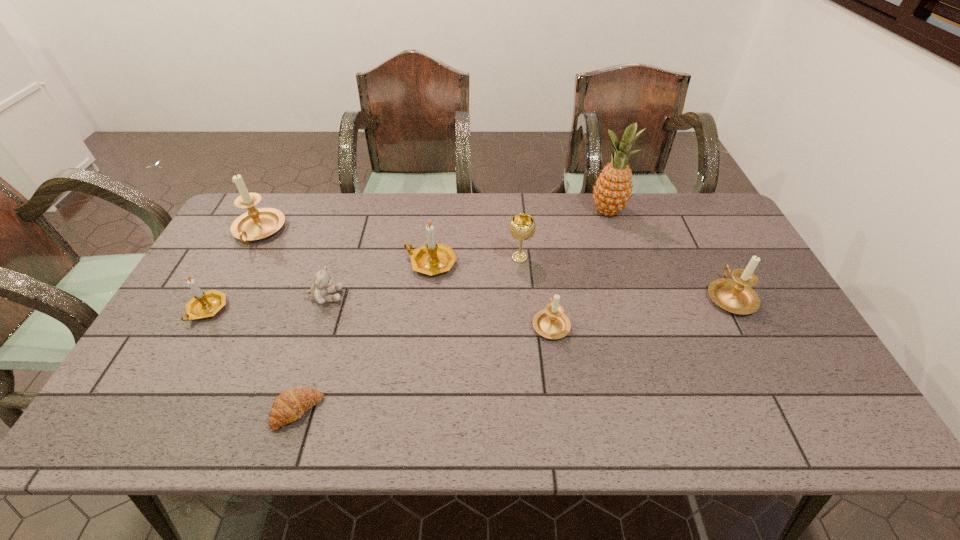
The height and width of the screenshot is (540, 960). In order to click on vacant space at the far right corner in this screenshot , I will do `click(693, 200)`.

Where is `free spot between the chalice and the smaller gold candle holder`? This screenshot has height=540, width=960. free spot between the chalice and the smaller gold candle holder is located at coordinates (363, 284).

The image size is (960, 540). In order to click on free spot between the teddy bear and the rightmost candle holder in this screenshot , I will do tap(528, 296).

Where is `vacant area that lies between the chalice and the pineapple`? The image size is (960, 540). vacant area that lies between the chalice and the pineapple is located at coordinates (564, 235).

Find the location of a particular element. This screenshot has height=540, width=960. vacant region between the tallest object and the smaller gold candle holder is located at coordinates (407, 261).

This screenshot has height=540, width=960. I want to click on free point between the chalice and the tallest object, so click(564, 235).

You are a GUI agent. You are given a task and a screenshot of the screen. Output one action in this format:
    pyautogui.click(x=<x>, y=<y>)
    Task: Click on the vacant space that is in between the rightmost beige candle holder and the crescent roll
    
    Given the screenshot: What is the action you would take?
    pyautogui.click(x=514, y=354)

Find the location of a particular element. free point between the second shortest object and the nearer gold candle holder is located at coordinates (267, 303).

Image resolution: width=960 pixels, height=540 pixels. Find the location of `free space between the farthest beige candle holder and the smaller gold candle holder`. free space between the farthest beige candle holder and the smaller gold candle holder is located at coordinates (233, 271).

Where is `unoccupied position between the smaller gold candle holder and the second object from right to left`? unoccupied position between the smaller gold candle holder and the second object from right to left is located at coordinates (407, 261).